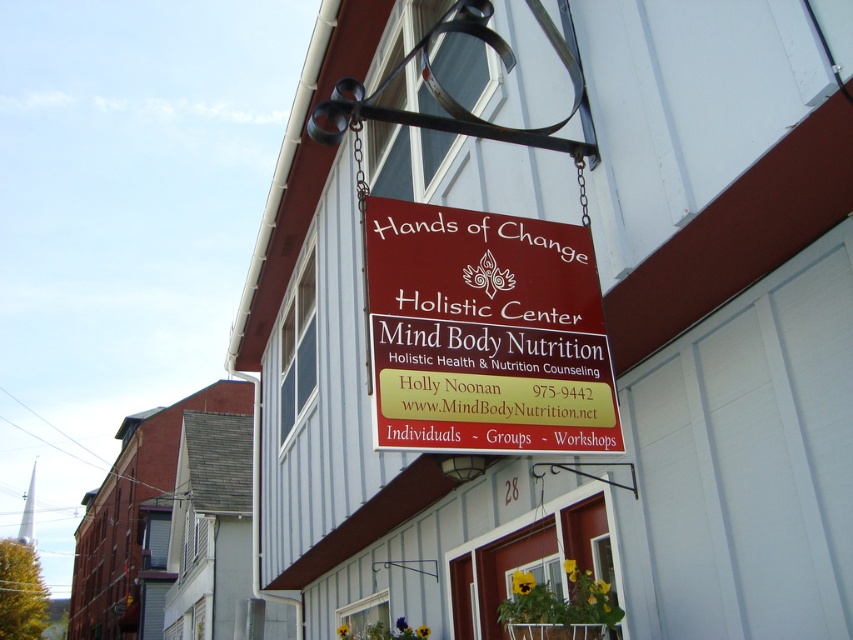
Question: Can you confirm if matte red sign at center is positioned to the right of maroon wood sign at center?

Choices:
 (A) yes
 (B) no

Answer: (A)

Question: Which of the following is the farthest from the observer?

Choices:
 (A) maroon wood sign at center
 (B) matte red sign at center

Answer: (B)

Question: Which of the following is the closest to the observer?

Choices:
 (A) (469, 429)
 (B) (824, 301)

Answer: (A)

Question: Is matte red sign at center positioned in front of maroon wood sign at center?

Choices:
 (A) yes
 (B) no

Answer: (B)

Question: Which object appears closest to the camera in this image?

Choices:
 (A) maroon wood sign at center
 (B) matte red sign at center

Answer: (A)

Question: In this image, where is matte red sign at center located relative to maroon wood sign at center?

Choices:
 (A) right
 (B) left

Answer: (A)